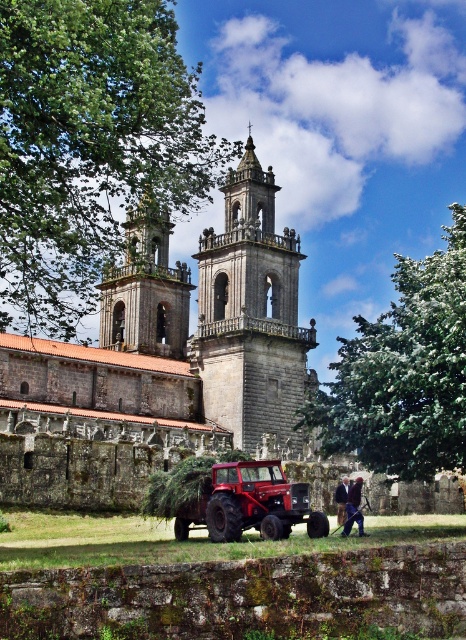
Question: Among these points, which one is farthest from the camera?

Choices:
 (A) (345, 500)
 (B) (152, 342)
 (C) (281, 426)

Answer: (B)

Question: Is gray stone bell tower at center further to camera compared to smooth stone tower at center?

Choices:
 (A) no
 (B) yes

Answer: (B)

Question: Considering the real-world distances, which object is closest to the smooth stone tower at center?

Choices:
 (A) dark brown leather jacket at lower center
 (B) gray stone bell tower at center
 (C) brown leather jacket at center

Answer: (B)

Question: In this image, where is stone church at center located relative to dark brown leather jacket at lower center?

Choices:
 (A) above
 (B) below

Answer: (A)

Question: Which point is farther to the camera?

Choices:
 (A) gray stone bell tower at center
 (B) stone church at center

Answer: (A)

Question: Is smooth stone tower at center below dark brown leather jacket at lower center?

Choices:
 (A) no
 (B) yes

Answer: (A)